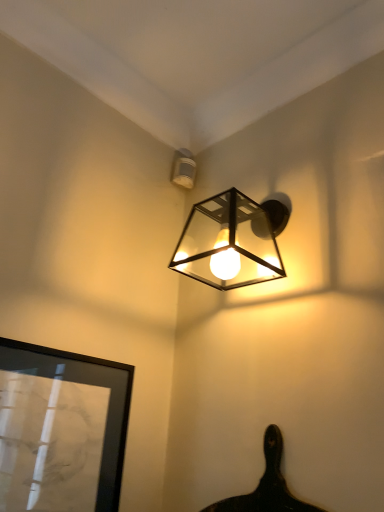
Question: Is metallic cube-shaped light fixture at upper center, acting as the 1th lamp starting from the front, oriented away from black glossy picture frame at lower left?

Choices:
 (A) yes
 (B) no

Answer: (B)

Question: Is metallic cube-shaped light fixture at upper center, which is counted as the second lamp, starting from the top, in front of black glossy picture frame at lower left?

Choices:
 (A) yes
 (B) no

Answer: (B)

Question: Would you say metallic cube-shaped light fixture at upper center, which is counted as the second lamp, starting from the top, contains black glossy picture frame at lower left?

Choices:
 (A) no
 (B) yes

Answer: (A)

Question: From a real-world perspective, is metallic cube-shaped light fixture at upper center, marked as the first lamp in a bottom-to-top arrangement, located higher than black glossy picture frame at lower left?

Choices:
 (A) no
 (B) yes

Answer: (B)

Question: From the image's perspective, is metallic cube-shaped light fixture at upper center, marked as the first lamp in a bottom-to-top arrangement, above black glossy picture frame at lower left?

Choices:
 (A) yes
 (B) no

Answer: (A)

Question: From the image's perspective, is black glossy picture frame at lower left above or below metallic cube-shaped light fixture at upper center, acting as the 1th lamp starting from the front?

Choices:
 (A) below
 (B) above

Answer: (A)

Question: Is point (94, 415) positioned closer to the camera than point (261, 242)?

Choices:
 (A) closer
 (B) farther

Answer: (A)

Question: Would you say black glossy picture frame at lower left is to the left or to the right of metallic cube-shaped light fixture at upper center, acting as the 1th lamp starting from the front, in the picture?

Choices:
 (A) left
 (B) right

Answer: (A)

Question: Do you think black glossy picture frame at lower left is within metallic cube-shaped light fixture at upper center, marked as the first lamp in a bottom-to-top arrangement, or outside of it?

Choices:
 (A) outside
 (B) inside

Answer: (A)

Question: From their relative heights in the image, would you say white plastic sensor at upper center, the 1th lamp when ordered from back to front, is taller or shorter than black glossy picture frame at lower left?

Choices:
 (A) tall
 (B) short

Answer: (B)

Question: Considering the positions of point (175, 155) and point (100, 457), is point (175, 155) closer or farther from the camera than point (100, 457)?

Choices:
 (A) farther
 (B) closer

Answer: (A)

Question: From a real-world perspective, is white plastic sensor at upper center, the 1th lamp when ordered from back to front, physically located above or below black glossy picture frame at lower left?

Choices:
 (A) above
 (B) below

Answer: (A)

Question: From the image's perspective, relative to black glossy picture frame at lower left, is white plastic sensor at upper center, which is the second lamp in front-to-back order, above or below?

Choices:
 (A) below
 (B) above

Answer: (B)

Question: Which is correct: black glossy picture frame at lower left is inside white plastic sensor at upper center, which is the second lamp in front-to-back order, or outside of it?

Choices:
 (A) inside
 (B) outside

Answer: (B)

Question: From a real-world perspective, is black glossy picture frame at lower left above or below white plastic sensor at upper center, the 1th lamp when ordered from back to front?

Choices:
 (A) below
 (B) above

Answer: (A)